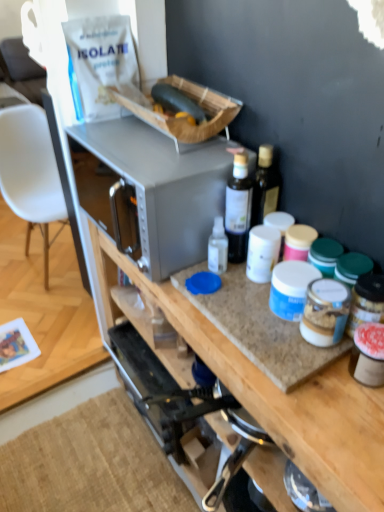
What is the approximate height of white plastic chair at left?

white plastic chair at left is 31.94 inches in height.

This screenshot has width=384, height=512. What do you see at coordinates (151, 190) in the screenshot? I see `satin silver microwave at center` at bounding box center [151, 190].

This screenshot has width=384, height=512. Find the location of `white plastic chair at left`. white plastic chair at left is located at coordinates (31, 173).

From the picture: Is granite countertop at center wider or thinner than white plastic chair at left?

In the image, granite countertop at center appears to be more narrow than white plastic chair at left.

Is there a large distance between granite countertop at center and white plastic chair at left?

Indeed, granite countertop at center is not near white plastic chair at left.

Does granite countertop at center have a smaller size compared to white plastic chair at left?

No, granite countertop at center is not smaller than white plastic chair at left.

Is granite countertop at center surrounding white plastic chair at left?

No, white plastic chair at left is not surrounded by granite countertop at center.

Considering the points (103, 306) and (237, 174), which point is in front, point (103, 306) or point (237, 174)?

The point (237, 174) is closer.

From the image's perspective, relative to transparent plastic bottle at center, is granite countertop at center above or below?

granite countertop at center is situated lower than transparent plastic bottle at center in the image.

Considering their positions, is granite countertop at center located in front of or behind transparent plastic bottle at center?

Clearly, granite countertop at center is in front of transparent plastic bottle at center.

Considering the relative sizes of granite countertop at center and transparent plastic bottle at center in the image provided, is granite countertop at center smaller than transparent plastic bottle at center?

Actually, granite countertop at center might be larger than transparent plastic bottle at center.

Can granite countertop at center be found inside transparent plastic bottle at center?

No, granite countertop at center is not a part of transparent plastic bottle at center.

Which object is positioned more to the left, transparent plastic bottle at center or granite countertop at center?

Positioned to the left is granite countertop at center.

In terms of height, does transparent plastic bottle at center look taller or shorter compared to granite countertop at center?

Clearly, transparent plastic bottle at center is shorter compared to granite countertop at center.

The image size is (384, 512). I want to click on cabinetry below the transparent plastic bottle at center (from a real-world perspective), so click(x=277, y=394).

Which object is further away from the camera, transparent plastic bottle at center or white plastic chair at left?

white plastic chair at left is further away from the camera.

Does transparent plastic bottle at center have a smaller size compared to white plastic chair at left?

Indeed, transparent plastic bottle at center has a smaller size compared to white plastic chair at left.

Locate an element on the screen. bottle lying below the white plastic chair at left (from the image's perspective) is located at coordinates (238, 208).

From a real-world perspective, is green matte zucchini at upper center physically located above or below granite countertop at center?

In terms of real-world spatial position, green matte zucchini at upper center is above granite countertop at center.

Can you confirm if green matte zucchini at upper center is smaller than granite countertop at center?

Yes, green matte zucchini at upper center is smaller than granite countertop at center.

From the picture: Is green matte zucchini at upper center at the left side of granite countertop at center?

Yes.

Which of these two, green matte zucchini at upper center or granite countertop at center, stands taller?

With more height is granite countertop at center.

Does point (231, 216) lie in front of point (97, 149)?

Yes.

Considering the sizes of objects transparent plastic bottle at center and satin silver microwave at center in the image provided, who is wider, transparent plastic bottle at center or satin silver microwave at center?

With larger width is satin silver microwave at center.

From the picture: Which is correct: transparent plastic bottle at center is inside satin silver microwave at center, or outside of it?

transparent plastic bottle at center cannot be found inside satin silver microwave at center.

Considering the sizes of green matte zucchini at upper center and transparent plastic bottle at center in the image, is green matte zucchini at upper center taller or shorter than transparent plastic bottle at center?

Clearly, green matte zucchini at upper center is shorter compared to transparent plastic bottle at center.

I want to click on bottle below the green matte zucchini at upper center (from the image's perspective), so click(238, 208).

From the image's perspective, which object appears higher, green matte zucchini at upper center or transparent plastic bottle at center?

green matte zucchini at upper center, from the image's perspective.

The height and width of the screenshot is (512, 384). I want to click on chair on the left of granite countertop at center, so click(31, 173).

In order to click on cabinetry located in front of the transparent plastic bottle at center in this screenshot , I will do `click(277, 394)`.

Considering their positions, is satin silver microwave at center positioned further to transparent plastic bottle at center than green matte zucchini at upper center?

The object further to transparent plastic bottle at center is green matte zucchini at upper center.

Based on the photo, when comparing their distances from transparent plastic bottle at center, does green matte zucchini at upper center or granite countertop at center seem further?

granite countertop at center lies further to transparent plastic bottle at center than the other object.

When comparing their distances from satin silver microwave at center, does transparent plastic bottle at center or white plastic chair at left seem closer?

The object closer to satin silver microwave at center is transparent plastic bottle at center.

Considering their positions, is granite countertop at center positioned further to transparent plastic bottle at center than white plastic chair at left?

Among the two, white plastic chair at left is located further to transparent plastic bottle at center.

When comparing their distances from green matte zucchini at upper center, does satin silver microwave at center or white plastic chair at left seem further?

The object further to green matte zucchini at upper center is white plastic chair at left.

Consider the image. When comparing their distances from granite countertop at center, does transparent plastic bottle at center or green matte zucchini at upper center seem further?

green matte zucchini at upper center lies further to granite countertop at center than the other object.

Considering their positions, is white plastic chair at left positioned further to granite countertop at center than transparent plastic bottle at center?

Among the two, white plastic chair at left is located further to granite countertop at center.

Based on their spatial positions, is granite countertop at center or satin silver microwave at center further from transparent plastic bottle at center?

Among the two, granite countertop at center is located further to transparent plastic bottle at center.

Where is `microwave oven between green matte zucchini at upper center and granite countertop at center in the vertical direction`? Image resolution: width=384 pixels, height=512 pixels. microwave oven between green matte zucchini at upper center and granite countertop at center in the vertical direction is located at coordinates (151, 190).

Identify the location of bottle between satin silver microwave at center and granite countertop at center from top to bottom. This screenshot has height=512, width=384. (238, 208).

This screenshot has width=384, height=512. Identify the location of food between white plastic chair at left and transparent plastic bottle at center from left to right. (177, 101).

The width and height of the screenshot is (384, 512). Find the location of `food located between granite countertop at center and white plastic chair at left in the depth direction`. food located between granite countertop at center and white plastic chair at left in the depth direction is located at coordinates (177, 101).